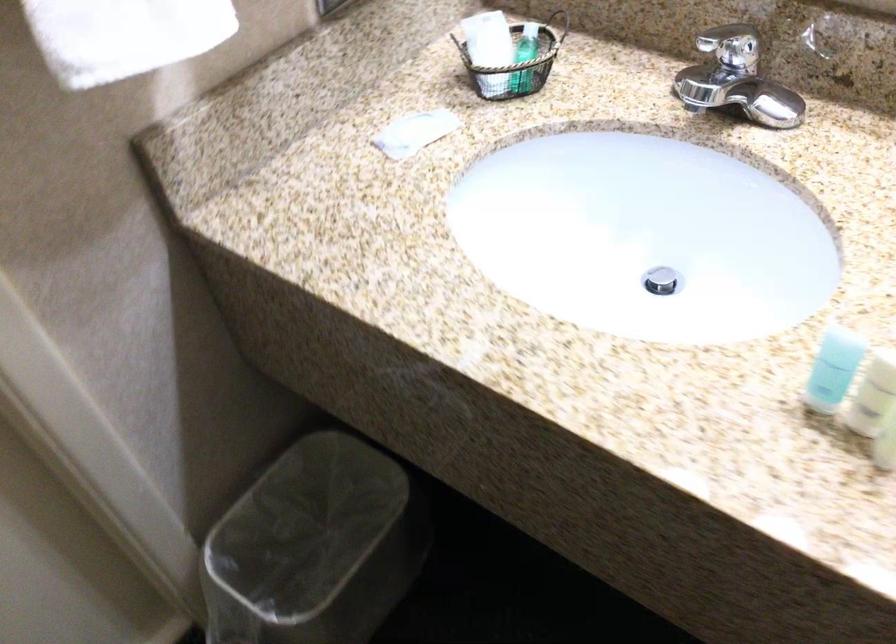
The image size is (896, 644). What do you see at coordinates (662, 281) in the screenshot?
I see `the sink drain` at bounding box center [662, 281].